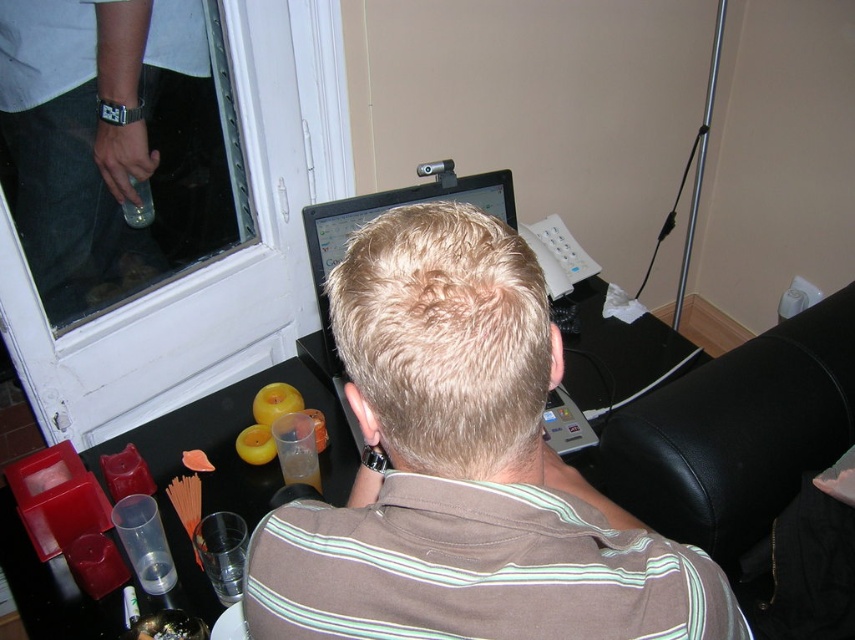
Question: Can you confirm if brown striped shirt at center is smaller than matte black monitor at upper center?

Choices:
 (A) yes
 (B) no

Answer: (A)

Question: Is brown striped shirt at center positioned at the back of transparent glass door at upper left?

Choices:
 (A) no
 (B) yes

Answer: (A)

Question: Among these objects, which one is farthest from the camera?

Choices:
 (A) matte black monitor at upper center
 (B) brown striped shirt at center
 (C) black plastic monitor at center
 (D) transparent glass door at upper left

Answer: (D)

Question: Can you confirm if transparent glass door at upper left is wider than black leather chair at right?

Choices:
 (A) yes
 (B) no

Answer: (B)

Question: Which point is farther from the camera taking this photo?

Choices:
 (A) click(326, 237)
 (B) click(357, 214)
 (C) click(655, 493)

Answer: (A)

Question: Based on their relative distances, which object is farther from the matte black monitor at upper center?

Choices:
 (A) brown striped shirt at center
 (B) transparent glass door at upper left
 (C) black plastic monitor at center

Answer: (A)